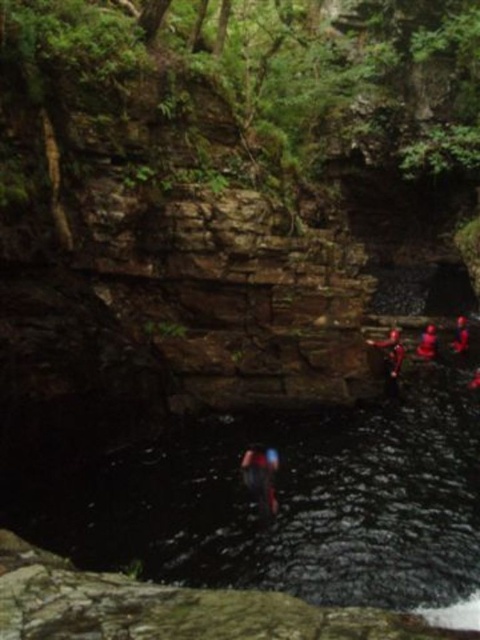
Is dark blue fabric at center closer to camera compared to red fabric person at right?

Yes.

Can you confirm if dark blue fabric at center is smaller than red fabric person at right?

Indeed, dark blue fabric at center has a smaller size compared to red fabric person at right.

Describe the element at coordinates (261, 476) in the screenshot. I see `dark blue fabric at center` at that location.

Where is `dark blue fabric at center`? The height and width of the screenshot is (640, 480). dark blue fabric at center is located at coordinates (261, 476).

Between dark blue fabric at center and matte red helmet at right, which one has less height?

dark blue fabric at center is shorter.

Is point (268, 480) closer to camera compared to point (434, 333)?

Yes, it is.

Where is `dark blue fabric at center`? This screenshot has width=480, height=640. dark blue fabric at center is located at coordinates (261, 476).

Can you confirm if matte red helmet at right is thinner than red fabric person at right?

Correct, matte red helmet at right's width is less than red fabric person at right's.

Describe the element at coordinates (427, 342) in the screenshot. I see `matte red helmet at right` at that location.

Locate an element on the screen. The width and height of the screenshot is (480, 640). matte red helmet at right is located at coordinates (427, 342).